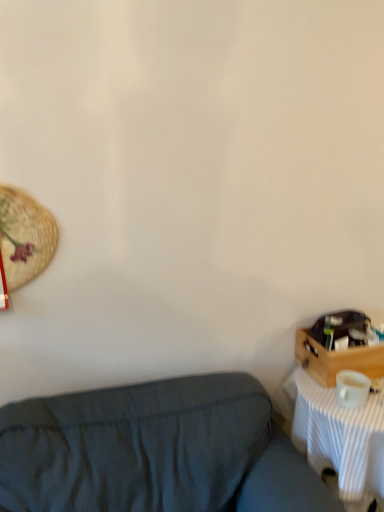
This screenshot has width=384, height=512. What do you see at coordinates (336, 359) in the screenshot?
I see `wooden crate at right` at bounding box center [336, 359].

At what (x,y) coordinates should I click in order to perform the action: click on wooden crate at right. Please return your answer as a coordinate pair (x, y). Looking at the image, I should click on (336, 359).

Image resolution: width=384 pixels, height=512 pixels. Identify the location of white matte coffee cup at right. (352, 389).

Where is `wooden crate at right`? This screenshot has width=384, height=512. wooden crate at right is located at coordinates coord(336,359).

Based on the photo, from a real-world perspective, relative to dark blue fabric couch at lower left, is white striped fabric at right vertically above or below?

Clearly, from a real-world perspective, white striped fabric at right is below dark blue fabric couch at lower left.

Can you tell me how much white striped fabric at right and dark blue fabric couch at lower left differ in facing direction?

They differ by 0.998 degrees in their facing directions.

Is white striped fabric at right spatially inside dark blue fabric couch at lower left, or outside of it?

white striped fabric at right is outside dark blue fabric couch at lower left.

Is point (355, 440) positioned behind point (195, 490)?

Yes, point (355, 440) is behind point (195, 490).

Who is more distant, white striped fabric at right or wooden crate at right?

wooden crate at right is more distant.

Consider the image. From the image's perspective, would you say white striped fabric at right is positioned over wooden crate at right?

No, from the image's perspective, white striped fabric at right is not on top of wooden crate at right.

Between white striped fabric at right and wooden crate at right, which one has smaller size?

Smaller between the two is wooden crate at right.

This screenshot has width=384, height=512. In order to click on drawer that is behind the white striped fabric at right in this screenshot , I will do coord(336,359).

Are dark blue fabric couch at lower left and white matte coffee cup at right located far from each other?

No, dark blue fabric couch at lower left is not far away from white matte coffee cup at right.

How many degrees apart are the facing directions of dark blue fabric couch at lower left and white matte coffee cup at right?

The angular difference between dark blue fabric couch at lower left and white matte coffee cup at right is 2.73 degrees.

Is dark blue fabric couch at lower left bigger or smaller than white matte coffee cup at right?

Considering their sizes, dark blue fabric couch at lower left takes up more space than white matte coffee cup at right.

Is white matte coffee cup at right situated inside white striped fabric at right or outside?

white matte coffee cup at right is located beyond the bounds of white striped fabric at right.

This screenshot has height=512, width=384. What are the coordinates of `desk that is on the right side of white matte coffee cup at right` in the screenshot? It's located at (339, 435).

Consider the image. Considering the relative sizes of white matte coffee cup at right and white striped fabric at right in the image provided, is white matte coffee cup at right smaller than white striped fabric at right?

Yes, white matte coffee cup at right is smaller than white striped fabric at right.

Considering the positions of points (344, 406) and (351, 414), is point (344, 406) farther from camera compared to point (351, 414)?

Yes, it is behind point (351, 414).

Considering the positions of point (376, 347) and point (314, 440), is point (376, 347) closer or farther from the camera than point (314, 440)?

Point (376, 347) is farther from the camera than point (314, 440).

From the image's perspective, is wooden crate at right above or below white striped fabric at right?

Clearly, from the image's perspective, wooden crate at right is above white striped fabric at right.

Considering the relative sizes of wooden crate at right and white striped fabric at right in the image provided, is wooden crate at right wider than white striped fabric at right?

Incorrect, the width of wooden crate at right does not surpass that of white striped fabric at right.

In the scene shown: Is wooden crate at right not near white striped fabric at right?

wooden crate at right is actually quite close to white striped fabric at right.

Considering the relative sizes of dark blue fabric couch at lower left and white striped fabric at right in the image provided, is dark blue fabric couch at lower left smaller than white striped fabric at right?

No.

This screenshot has height=512, width=384. What are the coordinates of `desk that appears on the right of dark blue fabric couch at lower left` in the screenshot? It's located at (339, 435).

Between dark blue fabric couch at lower left and white striped fabric at right, which one is positioned behind?

Positioned behind is white striped fabric at right.

Is dark blue fabric couch at lower left closer to the viewer compared to wooden crate at right?

Yes, dark blue fabric couch at lower left is closer to the camera.

Can you confirm if dark blue fabric couch at lower left is shorter than wooden crate at right?

In fact, dark blue fabric couch at lower left may be taller than wooden crate at right.

From the image's perspective, would you say dark blue fabric couch at lower left is shown under wooden crate at right?

Yes, from the image's perspective, dark blue fabric couch at lower left is below wooden crate at right.

Where is `studio couch above the white striped fabric at right (from a real-world perspective)`? The height and width of the screenshot is (512, 384). studio couch above the white striped fabric at right (from a real-world perspective) is located at coordinates (155, 451).

Identify the location of drawer lying behind the white striped fabric at right. The height and width of the screenshot is (512, 384). (336, 359).

From the picture: Which object lies nearer to the anchor point dark blue fabric couch at lower left, wooden crate at right or white striped fabric at right?

white striped fabric at right is closer to dark blue fabric couch at lower left.

Consider the image. Looking at the image, which one is located further to white striped fabric at right, dark blue fabric couch at lower left or white matte coffee cup at right?

The object further to white striped fabric at right is dark blue fabric couch at lower left.

Considering their positions, is white matte coffee cup at right positioned further to wooden crate at right than white striped fabric at right?

Based on the image, white striped fabric at right appears to be further to wooden crate at right.

Based on their spatial positions, is dark blue fabric couch at lower left or wooden crate at right closer to white striped fabric at right?

wooden crate at right lies closer to white striped fabric at right than the other object.

Estimate the real-world distances between objects in this image. Which object is further from wooden crate at right, white striped fabric at right or dark blue fabric couch at lower left?

Based on the image, dark blue fabric couch at lower left appears to be further to wooden crate at right.

Looking at this image, from the image, which object appears to be farther from wooden crate at right, dark blue fabric couch at lower left or white matte coffee cup at right?

dark blue fabric couch at lower left.

From the image, which object appears to be farther from dark blue fabric couch at lower left, white striped fabric at right or white matte coffee cup at right?

white matte coffee cup at right is positioned further to the anchor dark blue fabric couch at lower left.

Looking at the image, which one is located further to wooden crate at right, dark blue fabric couch at lower left or white striped fabric at right?

The object further to wooden crate at right is dark blue fabric couch at lower left.

Find the location of a particular element. coffee cup positioned between dark blue fabric couch at lower left and wooden crate at right from near to far is located at coordinates (352, 389).

Where is `desk positioned between dark blue fabric couch at lower left and wooden crate at right from near to far`? This screenshot has width=384, height=512. desk positioned between dark blue fabric couch at lower left and wooden crate at right from near to far is located at coordinates (339, 435).

Find the location of `coffee cup between dark blue fabric couch at lower left and white striped fabric at right`. coffee cup between dark blue fabric couch at lower left and white striped fabric at right is located at coordinates click(352, 389).

Find the location of a particular element. This screenshot has height=512, width=384. coffee cup that lies between wooden crate at right and white striped fabric at right from top to bottom is located at coordinates (352, 389).